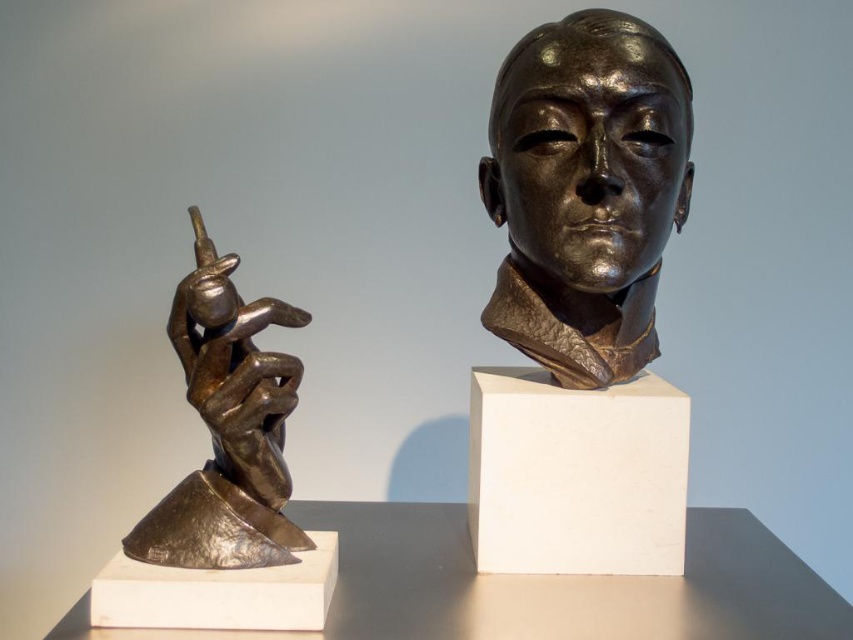
You are an art curator examining the two sculptures displayed on the dark surface. You notice two points marked on the image. The first point is at coordinates point [604,227] and the second point is at point [575,445]. From your perspective, which point is closer to you?

Point [604,227] is in front of point [575,445], so it is closer to you.

Looking at this image, you are an art curator arranging an exhibition. You need to place a new sculpture on the side opposite to the bronze head at center relative to the white matte pedestal at center. Which side should you place the new sculpture?

The bronze head at center is to the right of the white matte pedestal at center, so the new sculpture should be placed to the left of the white matte pedestal at center to be on the opposite side.